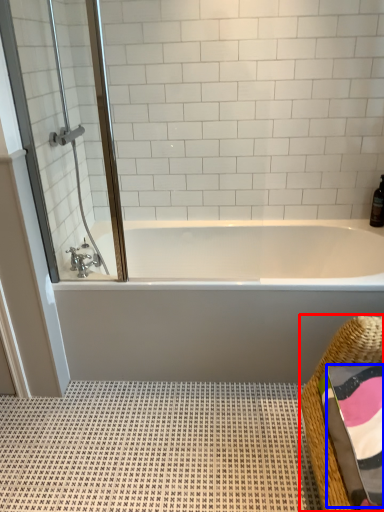
Question: Which object is closer to the camera taking this photo, basket (highlighted by a red box) or bath towel (highlighted by a blue box)?

Choices:
 (A) basket
 (B) bath towel

Answer: (A)